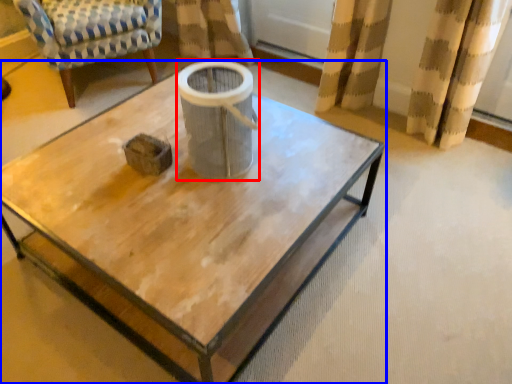
Question: Among these objects, which one is farthest to the camera, gray (highlighted by a red box) or coffee table (highlighted by a blue box)?

Choices:
 (A) gray
 (B) coffee table

Answer: (A)